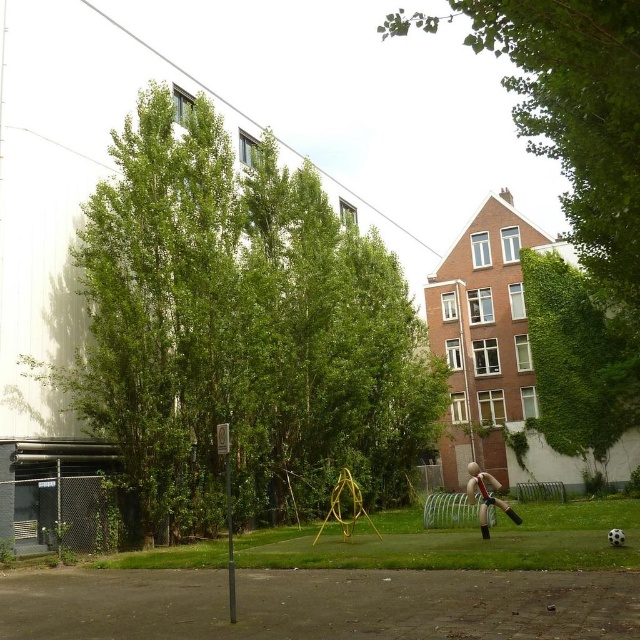
You are a photographer setting up a shot of the green leafy tree at center and the smooth beige mannequin at center. Which object should you focus on first if you want to capture both clearly in the same frame?

You should focus on the green leafy tree at center first because it is larger in size than the smooth beige mannequin at center, making it the primary subject for clear capture.

You are standing at the center of the paved area in the urban outdoor scene. You want to take a photo of the green leafy tree at center. Where should you position yourself relative to the soccer ball and the artificial human figure to ensure the tree is centered in your camera view?

To center the green leafy tree at center in your camera view, you should position yourself directly in front of the soccer ball and the artificial human figure since the tree is located at the center point of the scene.

In the scene shown: You are standing at the base of the green leafy tree at upper center and want to walk straight towards the smooth beige mannequin at center. How far will you have to walk to reach it?

The green leafy tree at upper center is 53.28 meters away from the smooth beige mannequin at center, so you will have to walk 53.28 meters to reach it.